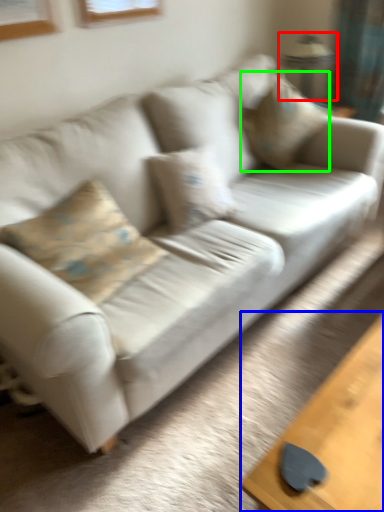
Question: Which is nearer to the lamp (highlighted by a red box)? table (highlighted by a blue box) or pillow (highlighted by a green box).

Choices:
 (A) table
 (B) pillow

Answer: (B)